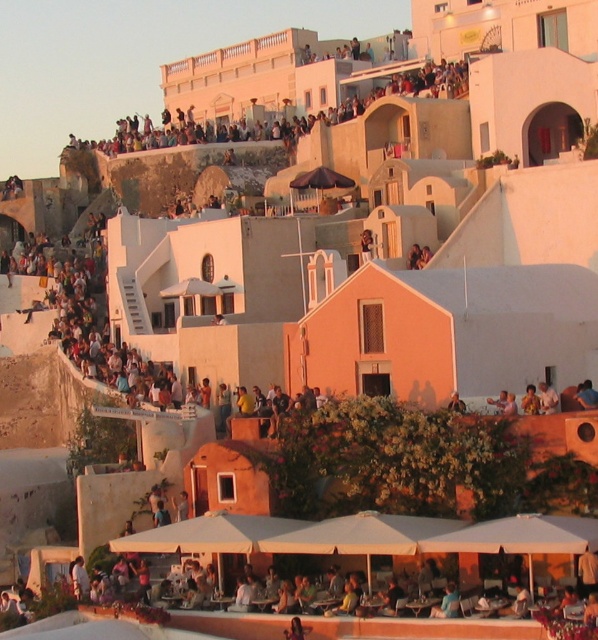
You are standing at the base of the hillside town and want to locate the matte white crowd at upper center. According to the 2D coordinates provided, what are the exact coordinates where you should look to find them?

The exact coordinates to locate the matte white crowd at upper center are at point (385,96).